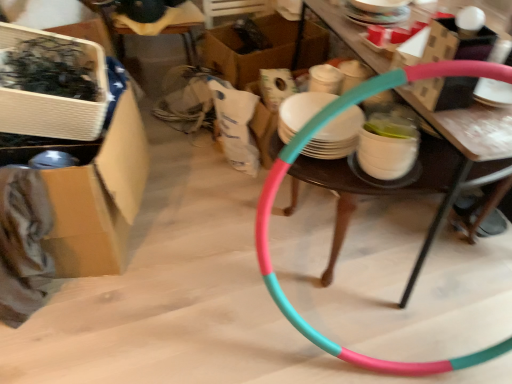
Locate an element on the screen. vacant area located to the right-hand side of teal plastic hoop at center is located at coordinates (437, 167).